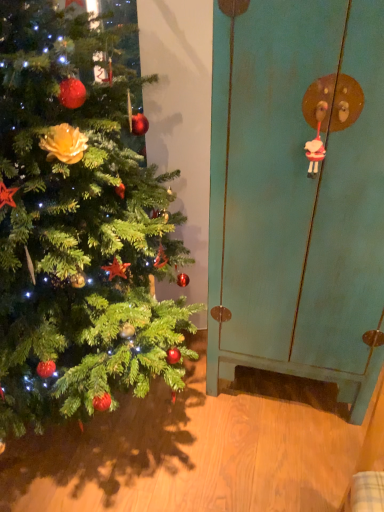
This screenshot has height=512, width=384. Find the location of `vacant space that is to the left of teal matte cabinet at right`. vacant space that is to the left of teal matte cabinet at right is located at coordinates (173, 428).